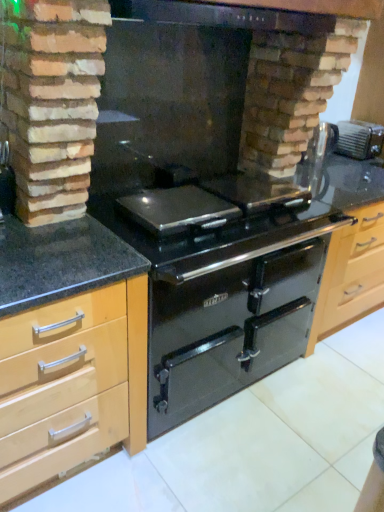
Question: Is black glass exhaust hood at upper center aimed at metallic silver toaster at upper right?

Choices:
 (A) yes
 (B) no

Answer: (B)

Question: Is black glass exhaust hood at upper center shorter than metallic silver toaster at upper right?

Choices:
 (A) no
 (B) yes

Answer: (B)

Question: Is black glass exhaust hood at upper center to the right of metallic silver toaster at upper right from the viewer's perspective?

Choices:
 (A) yes
 (B) no

Answer: (B)

Question: Is black glass exhaust hood at upper center looking in the opposite direction of metallic silver toaster at upper right?

Choices:
 (A) yes
 (B) no

Answer: (B)

Question: Is black glass exhaust hood at upper center far from metallic silver toaster at upper right?

Choices:
 (A) yes
 (B) no

Answer: (A)

Question: Does black glass exhaust hood at upper center have a smaller size compared to metallic silver toaster at upper right?

Choices:
 (A) yes
 (B) no

Answer: (B)

Question: Is the depth of metallic silver toaster at upper right greater than that of glossy black oven at center?

Choices:
 (A) no
 (B) yes

Answer: (B)

Question: Does metallic silver toaster at upper right appear on the right side of glossy black oven at center?

Choices:
 (A) no
 (B) yes

Answer: (B)

Question: Considering the relative sizes of metallic silver toaster at upper right and glossy black oven at center in the image provided, is metallic silver toaster at upper right wider than glossy black oven at center?

Choices:
 (A) no
 (B) yes

Answer: (A)

Question: Is metallic silver toaster at upper right touching glossy black oven at center?

Choices:
 (A) no
 (B) yes

Answer: (A)

Question: Is metallic silver toaster at upper right at the left side of glossy black oven at center?

Choices:
 (A) no
 (B) yes

Answer: (A)

Question: From the image's perspective, would you say metallic silver toaster at upper right is shown under glossy black oven at center?

Choices:
 (A) yes
 (B) no

Answer: (B)

Question: Is black glass fireplace at center at the left side of black glass exhaust hood at upper center?

Choices:
 (A) no
 (B) yes

Answer: (B)